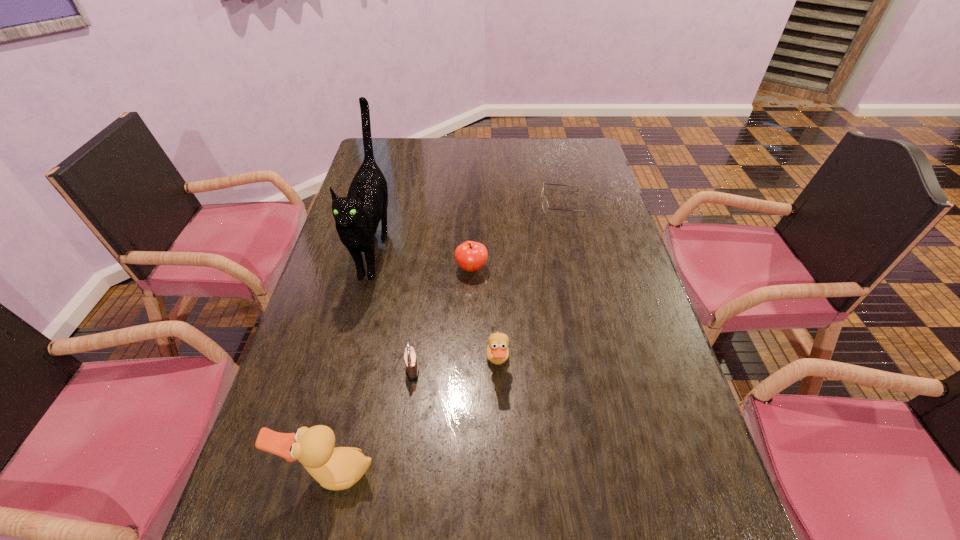
Identify the location of vacant region located 0.370m on the face of the tallest object. This screenshot has height=540, width=960. (329, 426).

At what (x,y) coordinates should I click in order to perform the action: click on vacant space located on the front-facing side of the spectacles. Please return your answer as a coordinate pair (x, y). The width and height of the screenshot is (960, 540). Looking at the image, I should click on (426, 203).

At what (x,y) coordinates should I click in order to perform the action: click on blank space located 0.120m on the front-facing side of the spectacles. Please return your answer as a coordinate pair (x, y). The image size is (960, 540). Looking at the image, I should click on (506, 203).

Where is `vacant space situated on the front-facing side of the spectacles`? vacant space situated on the front-facing side of the spectacles is located at coordinates (462, 203).

At what (x,y) coordinates should I click in order to perform the action: click on free space located on the left of the apple. Please return your answer as a coordinate pair (x, y). Looking at the image, I should click on coord(365,268).

Find the location of a particular element. free space located 0.190m on the left of the third object from left to right is located at coordinates (324, 370).

Image resolution: width=960 pixels, height=540 pixels. Find the location of `object at the near edge`. object at the near edge is located at coordinates (339, 468).

Find the location of a particular element. duck that is positioned at the left edge is located at coordinates (339, 468).

I want to click on cat that is positioned at the left edge, so click(357, 216).

Locate an element on the screen. The height and width of the screenshot is (540, 960). object that is at the right edge is located at coordinates (545, 206).